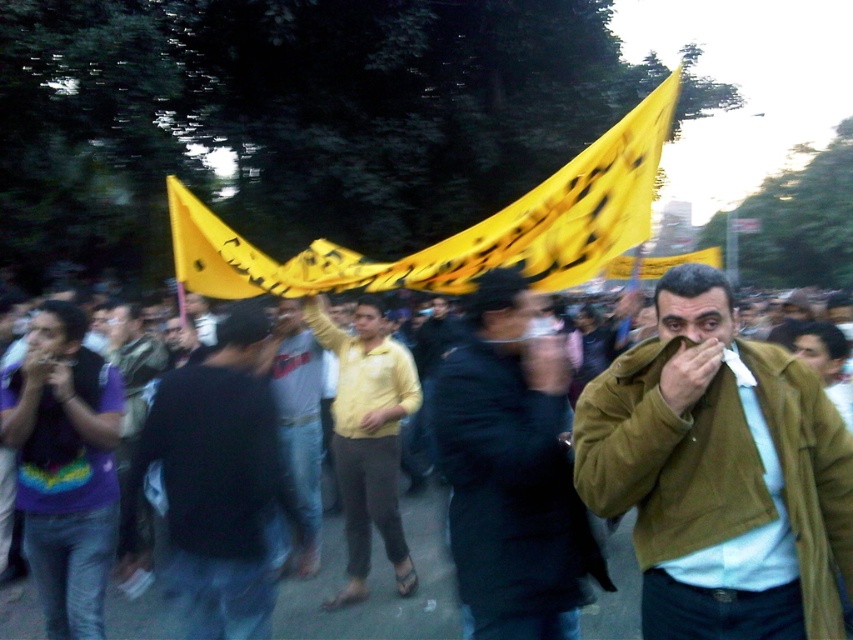
You are a photographer trying to capture a clear shot of the black matte shirt at center. Based on the coordinates provided, where should you focus your camera to ensure the subject is in sharp focus?

You should focus your camera at point (x=218, y=484) to ensure the black matte shirt at center is in sharp focus.

You are standing at the center of the protest area and want to reach the flag holder. There are two points marked in the scene, point A at coordinates point (579,579) and point B at coordinates point (70,410). Which point is closer to the flag holder?

Point A at coordinates point (579,579) is in front of point B at coordinates point (70,410), so it is closer to the flag holder.